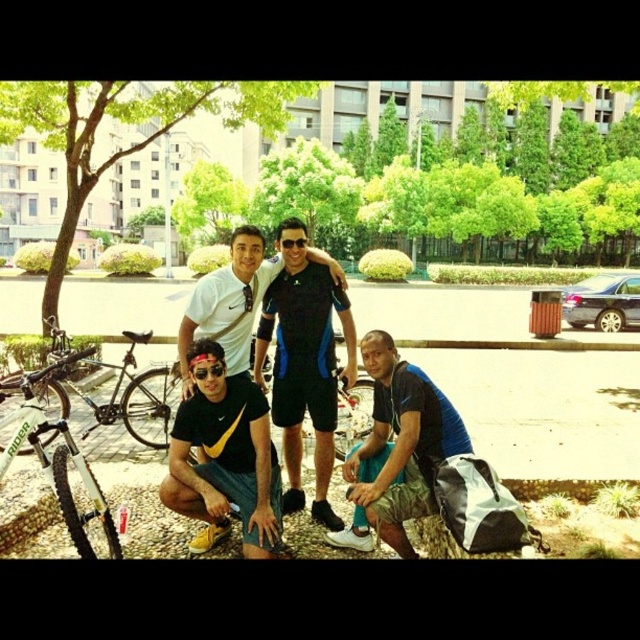
Is point (204, 358) farther from viewer compared to point (324, 481)?

No, it is in front of (324, 481).

Can you confirm if black matte t-shirt at center is bigger than blue athletic shorts at center?

No, black matte t-shirt at center is not bigger than blue athletic shorts at center.

Measure the distance between black matte t-shirt at center and camera.

black matte t-shirt at center is 3.48 meters from camera.

Locate an element on the screen. This screenshot has height=640, width=640. black matte t-shirt at center is located at coordinates (225, 458).

Can you confirm if blue fabric shorts at lower center is positioned to the left of silver metallic bicycle at lower left?

No, blue fabric shorts at lower center is not to the left of silver metallic bicycle at lower left.

What do you see at coordinates (397, 449) in the screenshot?
I see `blue fabric shorts at lower center` at bounding box center [397, 449].

Find the location of a particular element. blue fabric shorts at lower center is located at coordinates (397, 449).

Consider the image. Is the position of blue athletic shorts at center more distant than that of silver metallic bicycle at lower left?

Yes, blue athletic shorts at center is further from the viewer.

Measure the distance from blue athletic shorts at center to silver metallic bicycle at lower left.

They are 5.34 feet apart.

Who is more forward, (349, 362) or (8, 449)?

Point (8, 449) is in front.

Locate an element on the screen. blue athletic shorts at center is located at coordinates (305, 362).